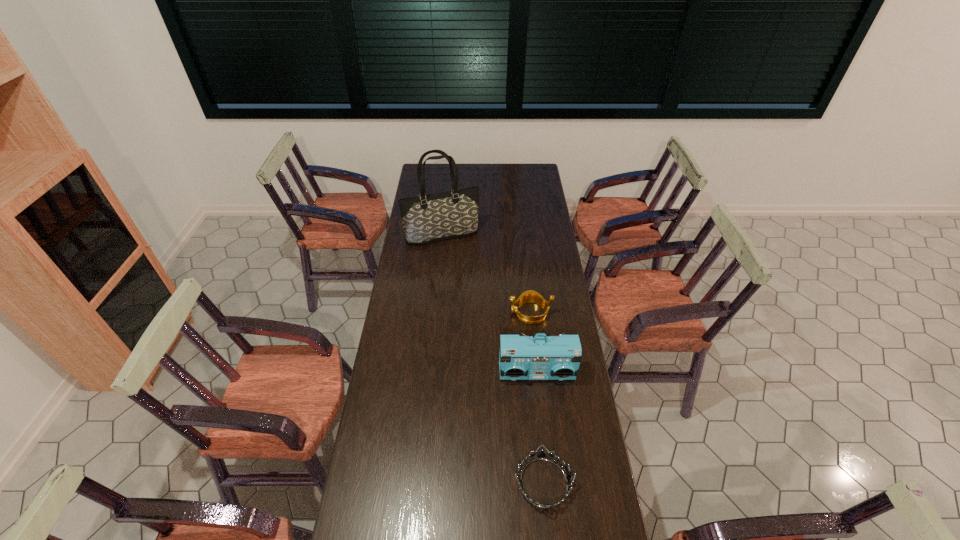
Identify the location of free space located 0.080m at the front emblem of the second shortest object. (490, 313).

Locate an element on the screen. Image resolution: width=960 pixels, height=540 pixels. free space located 0.230m at the front emblem of the second shortest object is located at coordinates (455, 313).

Locate an element on the screen. The width and height of the screenshot is (960, 540). free space located at the front emblem of the second shortest object is located at coordinates (492, 313).

You are a GUI agent. You are given a task and a screenshot of the screen. Output one action in this format:
    pyautogui.click(x=<x>, y=<y>)
    Task: Click on the blank space located 0.150m on the front-facing side of the shorter tiara
    
    Given the screenshot: What is the action you would take?
    pyautogui.click(x=466, y=483)

Where is `vacant area located on the front-facing side of the shorter tiara`? This screenshot has height=540, width=960. vacant area located on the front-facing side of the shorter tiara is located at coordinates click(468, 483).

Find the location of a particular element. free space located 0.210m on the front-facing side of the shorter tiara is located at coordinates (446, 483).

Where is `object present at the left edge`? The image size is (960, 540). object present at the left edge is located at coordinates (429, 218).

I want to click on radio receiver present at the right edge, so click(x=520, y=357).

I want to click on free space at the far edge, so click(x=447, y=170).

At what (x,y) coordinates should I click in order to perform the action: click on vacant space at the left edge. Please return your answer as a coordinate pair (x, y). Image resolution: width=960 pixels, height=540 pixels. Looking at the image, I should click on (392, 364).